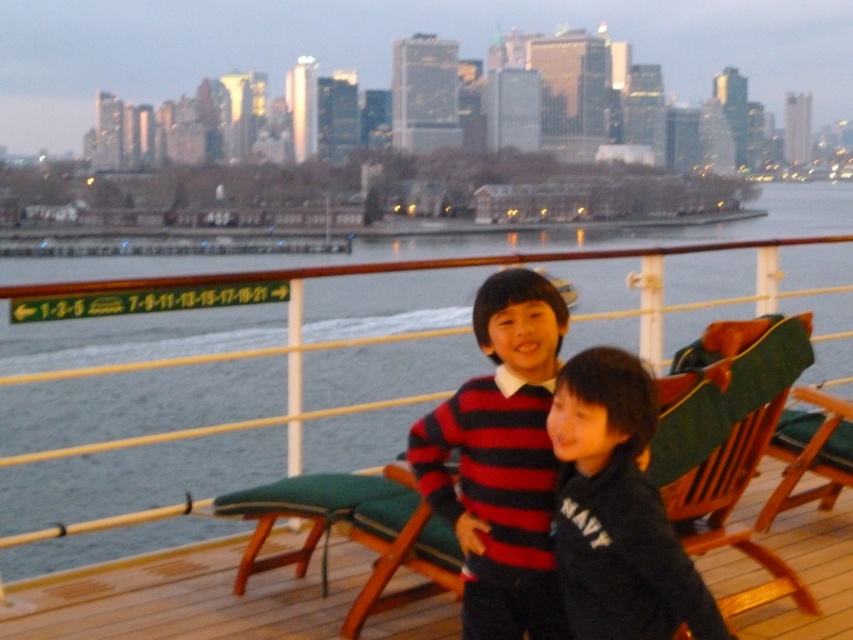
Is the position of striped knit sweater at center less distant than that of black fleece sweatshirt at center?

No, it is not.

Which of these two, striped knit sweater at center or black fleece sweatshirt at center, stands taller?

With more height is striped knit sweater at center.

Where is `striped knit sweater at center`? Image resolution: width=853 pixels, height=640 pixels. striped knit sweater at center is located at coordinates (502, 461).

Where is `striped knit sweater at center`? Image resolution: width=853 pixels, height=640 pixels. striped knit sweater at center is located at coordinates (502, 461).

Does black fleece sweatshirt at center have a greater height compared to green fabric cushion at right?

No, black fleece sweatshirt at center is not taller than green fabric cushion at right.

Does point (628, 481) come behind point (770, 420)?

That is False.

Is point (642, 545) farther from viewer compared to point (654, 456)?

No, it is not.

Image resolution: width=853 pixels, height=640 pixels. Find the location of `black fleece sweatshirt at center`. black fleece sweatshirt at center is located at coordinates (618, 509).

Does striped knit sweater at center have a lesser height compared to green water at center?

Yes, striped knit sweater at center is shorter than green water at center.

Identify the location of striped knit sweater at center. (502, 461).